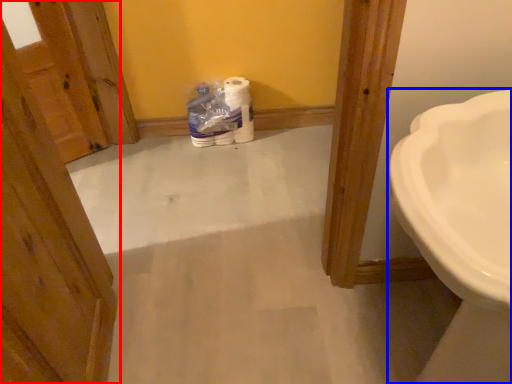
Question: Which object appears farthest to the camera in this image, door (highlighted by a red box) or sink (highlighted by a blue box)?

Choices:
 (A) door
 (B) sink

Answer: (B)